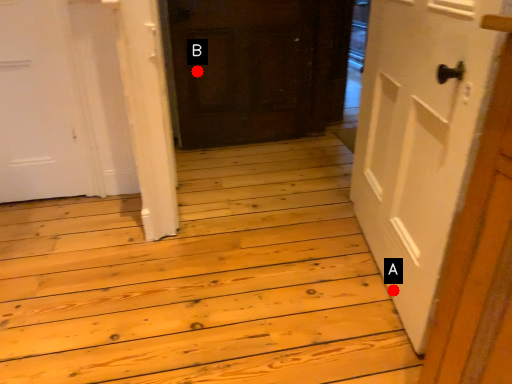
Question: Two points are circled on the image, labeled by A and B beside each circle. Which point is further to the camera?

Choices:
 (A) A is further
 (B) B is further

Answer: (B)